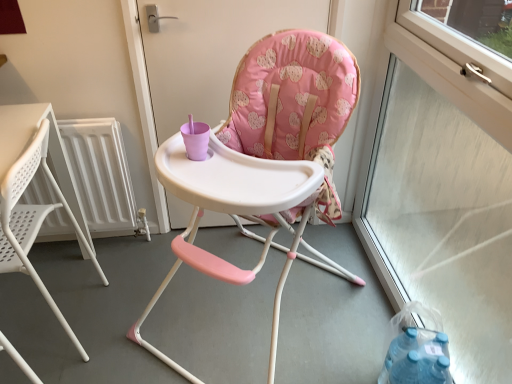
Question: Should I look upward or downward to see transparent glass window at right?

Choices:
 (A) down
 (B) up

Answer: (B)

Question: From the image's perspective, is transparent glass window at right above white metallic radiator at left?

Choices:
 (A) no
 (B) yes

Answer: (A)

Question: Can you confirm if transparent glass window at right is smaller than white metallic radiator at left?

Choices:
 (A) no
 (B) yes

Answer: (A)

Question: Considering the relative positions of transparent glass window at right and white metallic radiator at left in the image provided, is transparent glass window at right to the left of white metallic radiator at left from the viewer's perspective?

Choices:
 (A) yes
 (B) no

Answer: (B)

Question: Could you tell me if transparent glass window at right is facing white metallic radiator at left?

Choices:
 (A) yes
 (B) no

Answer: (A)

Question: Can you confirm if transparent glass window at right is wider than white metallic radiator at left?

Choices:
 (A) no
 (B) yes

Answer: (B)

Question: Would you say transparent glass window at right is outside white metallic radiator at left?

Choices:
 (A) no
 (B) yes

Answer: (B)

Question: Is pink fabric high chair at center inside white plastic chair at left, the first chair viewed from the left?

Choices:
 (A) no
 (B) yes

Answer: (A)

Question: Is white plastic chair at left, the first chair viewed from the left, positioned behind pink fabric high chair at center?

Choices:
 (A) no
 (B) yes

Answer: (A)

Question: From the image's perspective, would you say white plastic chair at left, acting as the 2th chair starting from the right, is shown under pink fabric high chair at center?

Choices:
 (A) yes
 (B) no

Answer: (A)

Question: From a real-world perspective, does white plastic chair at left, acting as the 2th chair starting from the right, stand above pink fabric high chair at center?

Choices:
 (A) yes
 (B) no

Answer: (B)

Question: From a real-world perspective, is white plastic chair at left, acting as the 2th chair starting from the right, under pink fabric high chair at center?

Choices:
 (A) no
 (B) yes

Answer: (B)

Question: Does white plastic chair at left, the first chair viewed from the left, have a larger size compared to pink fabric high chair at center?

Choices:
 (A) yes
 (B) no

Answer: (A)

Question: From a real-world perspective, is pink fabric high chair at center positioned over white metallic radiator at left based on gravity?

Choices:
 (A) yes
 (B) no

Answer: (A)